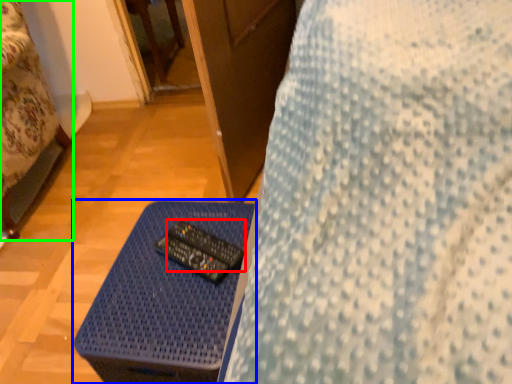
Question: Which is farther away from control (highlighted by a red box)? table (highlighted by a blue box) or furniture (highlighted by a green box)?

Choices:
 (A) table
 (B) furniture

Answer: (B)